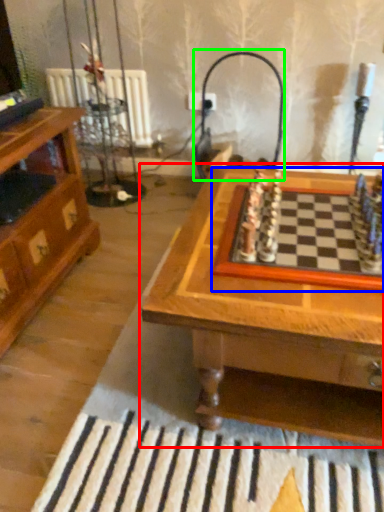
Question: Considering the real-world distances, which object is farthest from table (highlighted by a red box)? board game (highlighted by a blue box) or lamp (highlighted by a green box)?

Choices:
 (A) board game
 (B) lamp

Answer: (B)